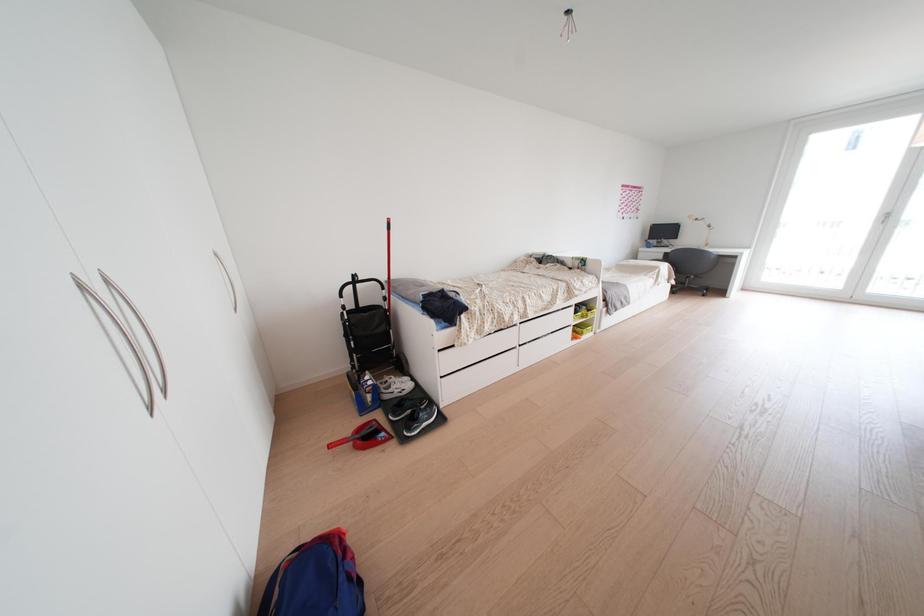
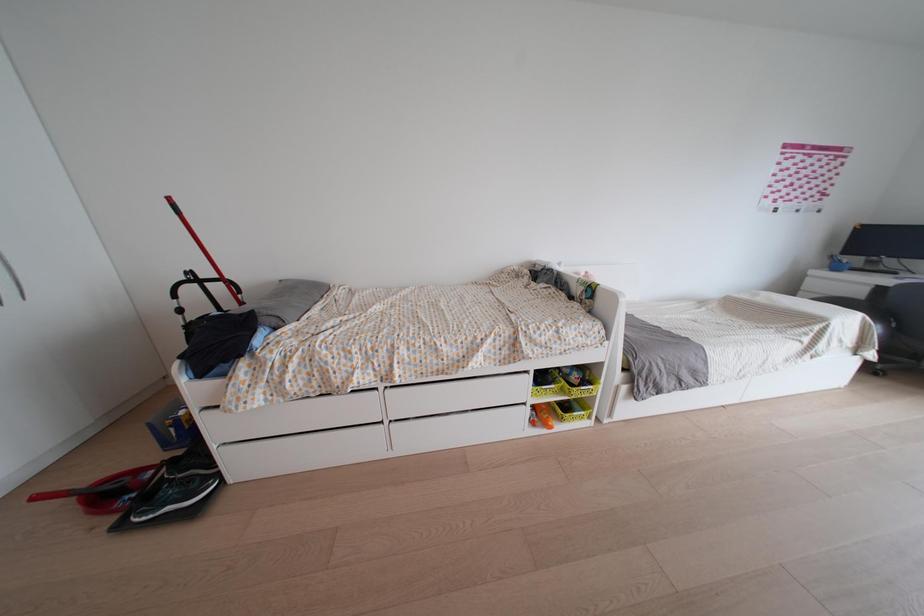
Which direction would the cameraman need to move to produce the second image?

The cameraman walked toward right, forward.